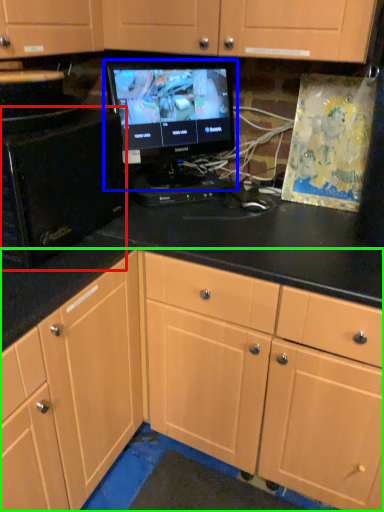
Question: Which object is the farthest from desktop computer (highlighted by a red box)? Choose among these: computer monitor (highlighted by a blue box) or cabinetry (highlighted by a green box).

Choices:
 (A) computer monitor
 (B) cabinetry

Answer: (B)